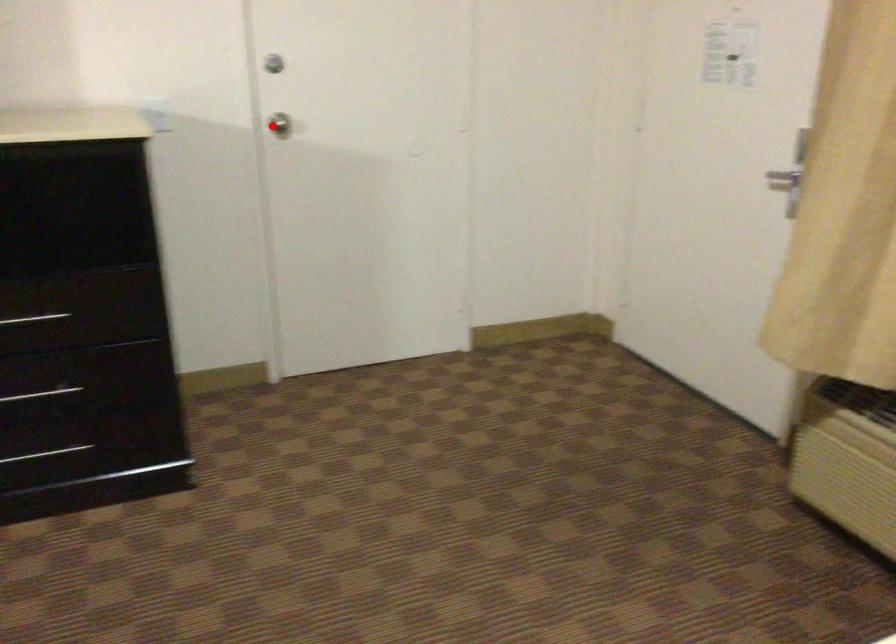
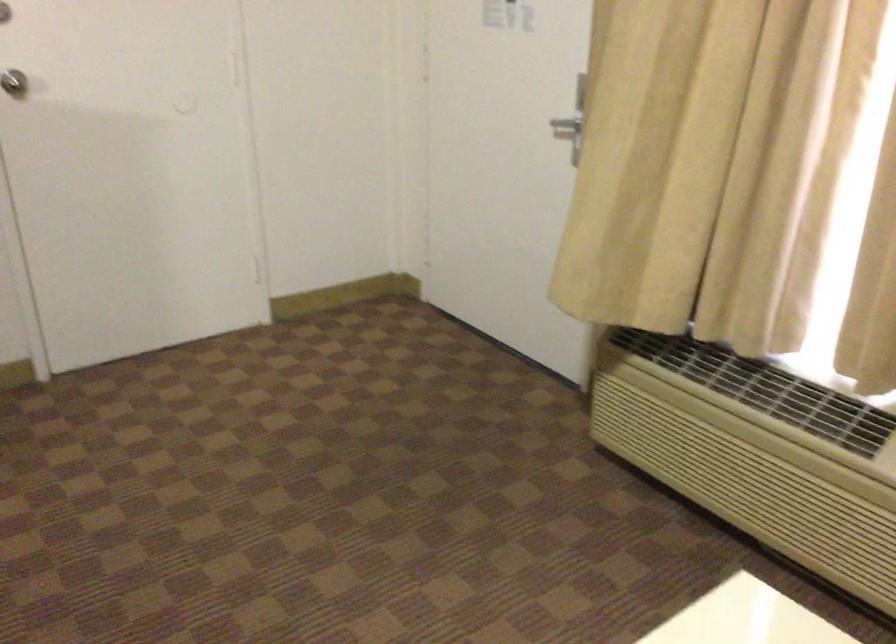
Question: I am providing you with two images of the same scene from different viewpoints. Given a red point in image1, look at the same physical point in image2. Is it:

Choices:
 (A) Closer to the viewpoint
 (B) Farther from the viewpoint

Answer: (A)